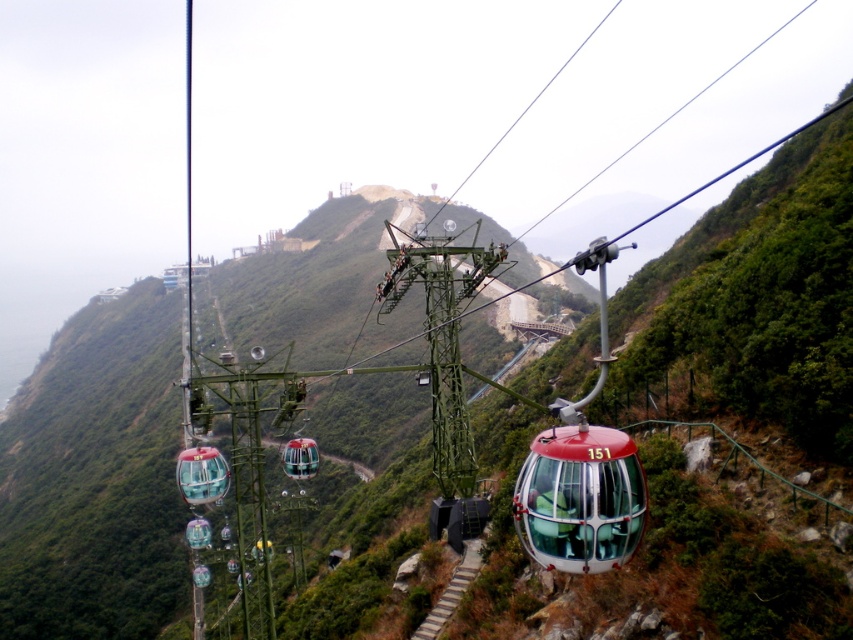
Question: Which point appears closest to the camera in this image?

Choices:
 (A) (621, 465)
 (B) (299, 458)

Answer: (A)

Question: Is metallic glass cable car at center above transparent glass cable car at center?

Choices:
 (A) no
 (B) yes

Answer: (B)

Question: Is the position of metallic glass cable car at center less distant than that of transparent glass cable car at center?

Choices:
 (A) yes
 (B) no

Answer: (A)

Question: Does metallic glass cable car at center appear under transparent glass cable car at center?

Choices:
 (A) no
 (B) yes

Answer: (A)